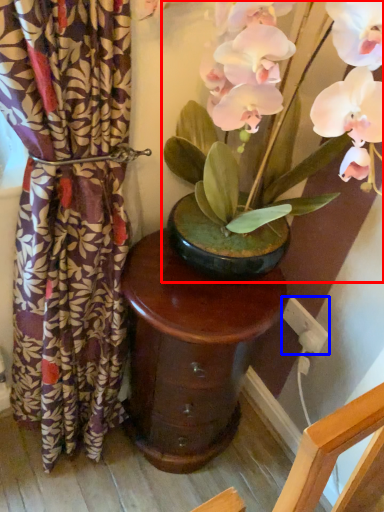
Question: Which object appears farthest to the camera in this image, houseplant (highlighted by a red box) or electric outlet (highlighted by a blue box)?

Choices:
 (A) houseplant
 (B) electric outlet

Answer: (B)